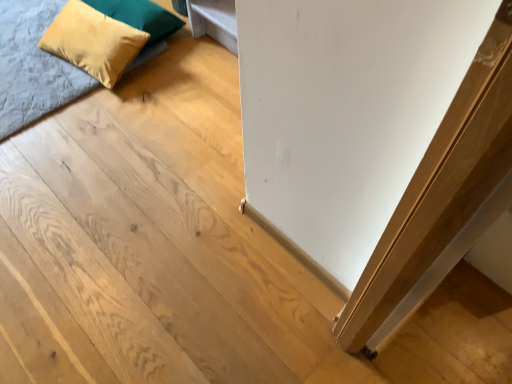
Question: Does velvet blue bed at upper left appear on the right side of suede yellow pillow at upper left, the 1th pillow viewed from the top?

Choices:
 (A) yes
 (B) no

Answer: (B)

Question: From the image's perspective, is velvet blue bed at upper left above suede yellow pillow at upper left, which appears as the second pillow when ordered from the bottom?

Choices:
 (A) no
 (B) yes

Answer: (A)

Question: From a real-world perspective, is velvet blue bed at upper left physically below suede yellow pillow at upper left, which appears as the second pillow when ordered from the bottom?

Choices:
 (A) no
 (B) yes

Answer: (B)

Question: Is velvet blue bed at upper left next to suede yellow pillow at upper left, which appears as the second pillow when ordered from the bottom, and touching it?

Choices:
 (A) yes
 (B) no

Answer: (B)

Question: Is velvet blue bed at upper left smaller than suede yellow pillow at upper left, the 1th pillow viewed from the top?

Choices:
 (A) yes
 (B) no

Answer: (B)

Question: From their relative heights in the image, would you say velvet blue bed at upper left is taller or shorter than suede yellow pillow at upper left, the 1th pillow viewed from the top?

Choices:
 (A) short
 (B) tall

Answer: (A)

Question: Is point pyautogui.click(x=77, y=72) closer or farther from the camera than point pyautogui.click(x=128, y=11)?

Choices:
 (A) farther
 (B) closer

Answer: (B)

Question: Looking at their shapes, would you say velvet blue bed at upper left is wider or thinner than suede yellow pillow at upper left, the 1th pillow viewed from the top?

Choices:
 (A) thin
 (B) wide

Answer: (B)

Question: In the image, is velvet blue bed at upper left positioned in front of or behind suede yellow pillow at upper left, which appears as the second pillow when ordered from the bottom?

Choices:
 (A) front
 (B) behind

Answer: (A)

Question: From a real-world perspective, relative to velvet blue bed at upper left, is suede yellow pillow at upper left, the 1th pillow viewed from the top, vertically above or below?

Choices:
 (A) below
 (B) above

Answer: (B)

Question: Is suede yellow pillow at upper left, which appears as the second pillow when ordered from the bottom, situated inside velvet blue bed at upper left or outside?

Choices:
 (A) inside
 (B) outside

Answer: (B)

Question: Does point tap(154, 3) appear closer or farther from the camera than point tap(14, 117)?

Choices:
 (A) farther
 (B) closer

Answer: (A)

Question: From their relative heights in the image, would you say suede yellow pillow at upper left, which appears as the second pillow when ordered from the bottom, is taller or shorter than velvet blue bed at upper left?

Choices:
 (A) tall
 (B) short

Answer: (A)

Question: Is suede yellow pillow at upper left, the 1th pillow viewed from the top, bigger or smaller than velvet yellow pillow at upper left, which is counted as the first pillow, starting from the bottom?

Choices:
 (A) small
 (B) big

Answer: (A)

Question: From a real-world perspective, is suede yellow pillow at upper left, the 1th pillow viewed from the top, above or below velvet yellow pillow at upper left, which is counted as the first pillow, starting from the bottom?

Choices:
 (A) below
 (B) above

Answer: (A)